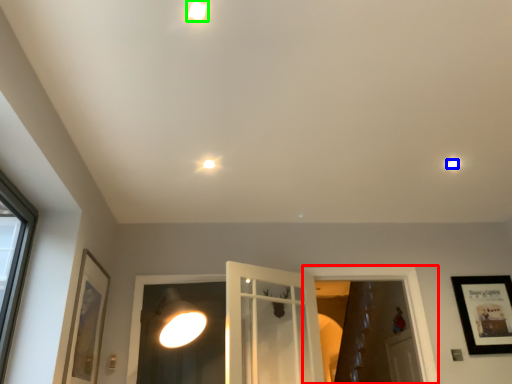
Question: Estimate the real-world distances between objects in this image. Which object is closer to window frame (highlighted by a red box), droplight (highlighted by a blue box) or droplight (highlighted by a green box)?

Choices:
 (A) droplight
 (B) droplight

Answer: (A)